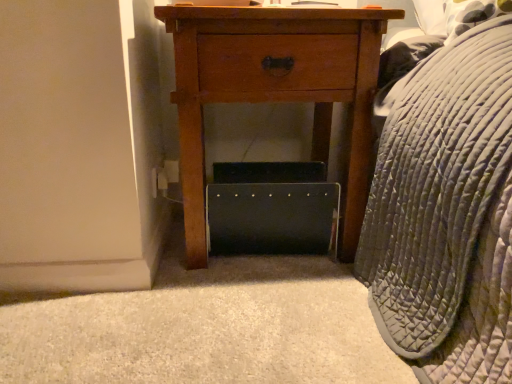
Question: Should I look upward or downward to see wooden nightstand at center?

Choices:
 (A) down
 (B) up

Answer: (B)